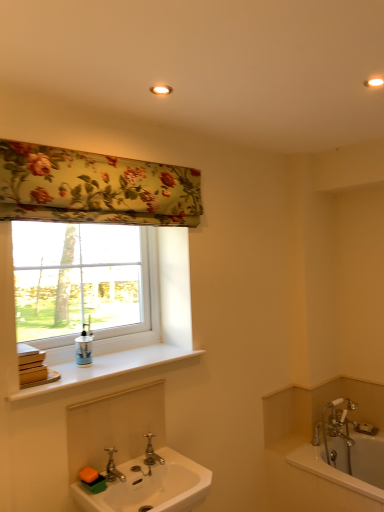
The width and height of the screenshot is (384, 512). Find the location of `vacant region to the right of white glossy soap dispenser at window`. vacant region to the right of white glossy soap dispenser at window is located at coordinates point(117,364).